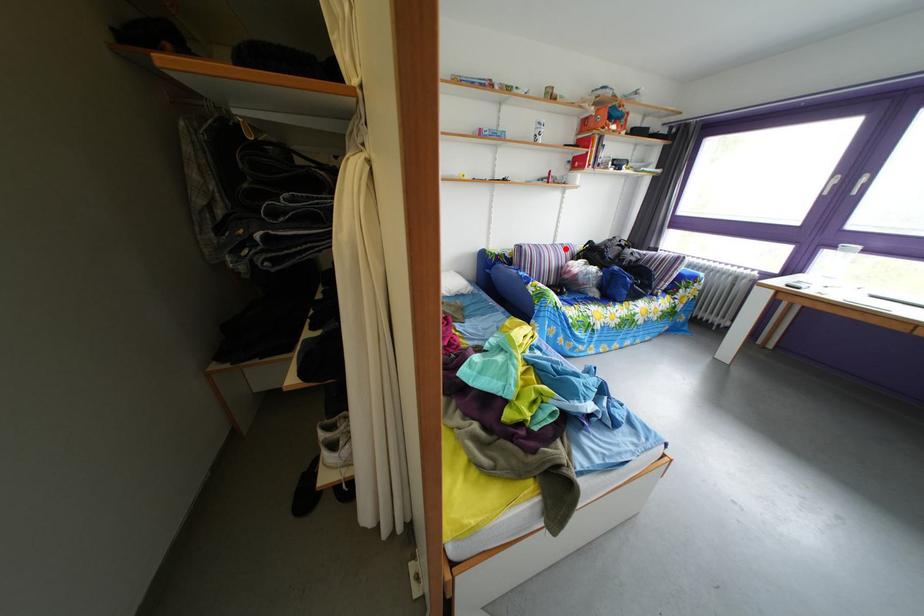
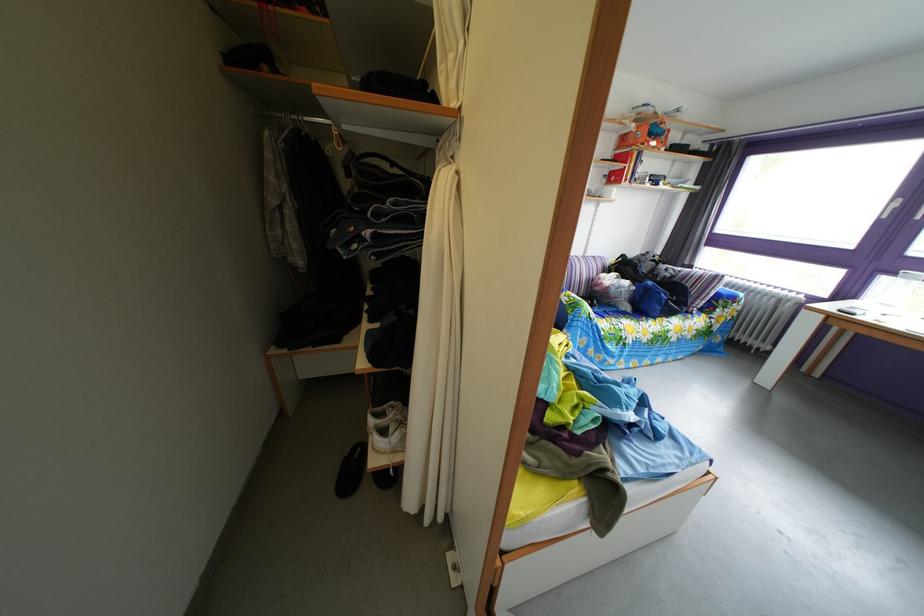
Question: I am providing you with two images of the same scene from different viewpoints. Image1 has a red point marked. In image2, the corresponding 3D location appears at what relative position? Reply with the corresponding letter.

Choices:
 (A) Closer
 (B) Farther

Answer: (B)